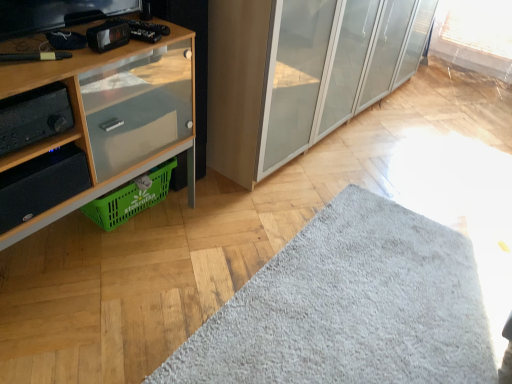
Question: From a real-world perspective, is green plastic basket at lower left below black matte stereo at left?

Choices:
 (A) yes
 (B) no

Answer: (A)

Question: Is green plastic basket at lower left not close to black matte stereo at left?

Choices:
 (A) yes
 (B) no

Answer: (B)

Question: Does green plastic basket at lower left have a lesser height compared to black matte stereo at left?

Choices:
 (A) yes
 (B) no

Answer: (B)

Question: Is green plastic basket at lower left turned away from black matte stereo at left?

Choices:
 (A) no
 (B) yes

Answer: (A)

Question: Does green plastic basket at lower left appear on the right side of black matte stereo at left?

Choices:
 (A) yes
 (B) no

Answer: (A)

Question: Is point (129, 201) closer or farther from the camera than point (254, 304)?

Choices:
 (A) farther
 (B) closer

Answer: (A)

Question: Is green plastic basket at lower left inside or outside of gray fluffy mat at lower center?

Choices:
 (A) outside
 (B) inside

Answer: (A)

Question: Based on their sizes in the image, would you say green plastic basket at lower left is bigger or smaller than gray fluffy mat at lower center?

Choices:
 (A) big
 (B) small

Answer: (B)

Question: From their relative heights in the image, would you say green plastic basket at lower left is taller or shorter than gray fluffy mat at lower center?

Choices:
 (A) tall
 (B) short

Answer: (A)

Question: Is point (26, 130) closer or farther from the camera than point (414, 279)?

Choices:
 (A) farther
 (B) closer

Answer: (B)

Question: Considering the positions of black matte stereo at left and gray fluffy mat at lower center in the image, is black matte stereo at left taller or shorter than gray fluffy mat at lower center?

Choices:
 (A) tall
 (B) short

Answer: (A)

Question: From a real-world perspective, is black matte stereo at left physically located above or below gray fluffy mat at lower center?

Choices:
 (A) above
 (B) below

Answer: (A)

Question: Considering the relative positions of black matte stereo at left and gray fluffy mat at lower center in the image provided, is black matte stereo at left to the left or to the right of gray fluffy mat at lower center?

Choices:
 (A) right
 (B) left

Answer: (B)

Question: From the image's perspective, is wooden cabinet at left positioned above or below transparent glass cabinet at center?

Choices:
 (A) above
 (B) below

Answer: (B)

Question: From a real-world perspective, is wooden cabinet at left above or below transparent glass cabinet at center?

Choices:
 (A) above
 (B) below

Answer: (B)